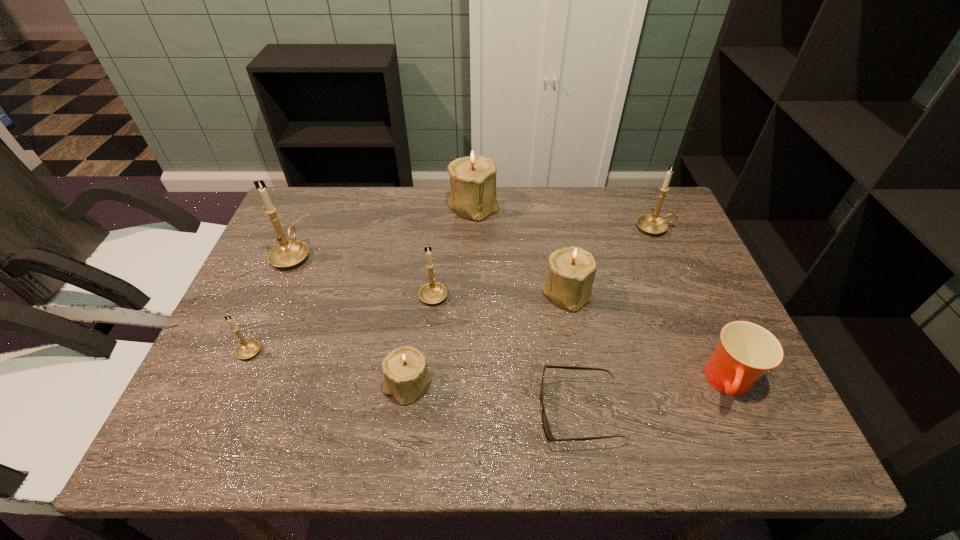
You are a GUI agent. You are given a task and a screenshot of the screen. Output one action in this format:
    pyautogui.click(x=<x>, y=<y>)
    Task: Click on the vacant area at the left edge
    The image size is (960, 540).
    Given the screenshot: What is the action you would take?
    pyautogui.click(x=237, y=400)

In the image, there is a desktop. Find the location of `vacant space at the right edge`. vacant space at the right edge is located at coordinates (708, 384).

In the image, there is a desktop. What are the coordinates of `free space at the near left corner` in the screenshot? It's located at (236, 415).

Identify the location of free region at the near right corner of the desktop. The image size is (960, 540). 745,448.

This screenshot has width=960, height=540. Find the location of `vacant space in between the rightmost gold candle holder and the cup`. vacant space in between the rightmost gold candle holder and the cup is located at coordinates (692, 306).

Identify the location of empty location between the rightmost beige candle_holder and the second biggest gold candle holder. The image size is (960, 540). (611, 260).

Locate an element on the screen. vacant area that lies between the rightmost gold candle holder and the second nearest candle_holder is located at coordinates (453, 288).

Where is `vacant space that is in between the biggest beige candle_holder and the smallest gold candle holder`? Image resolution: width=960 pixels, height=540 pixels. vacant space that is in between the biggest beige candle_holder and the smallest gold candle holder is located at coordinates (362, 277).

At what (x,y) coordinates should I click in order to perform the action: click on free point between the second gold candle holder from right to left and the smallest beige candle_holder. Please return your answer as a coordinate pair (x, y). Looking at the image, I should click on (420, 340).

At what (x,y) coordinates should I click in order to perform the action: click on vacant region between the sixth farthest candle_holder and the nearest beige candle_holder. Please return your answer as a coordinate pair (x, y). Image resolution: width=960 pixels, height=540 pixels. Looking at the image, I should click on (329, 367).